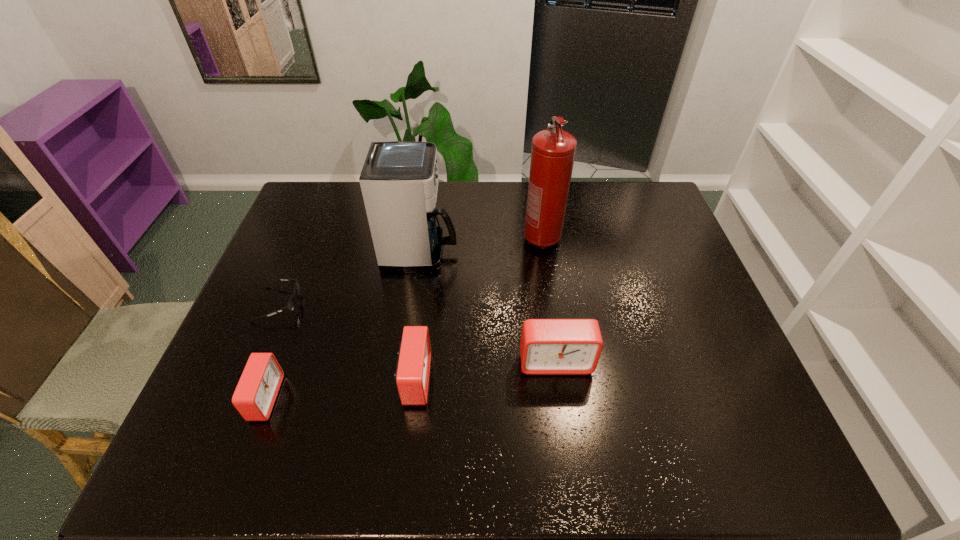
Observe the arrangement of all alarm clocks in the image. To keep them evenly spaced, where would you place another alarm clock on the right? Please locate a free space. Please provide its 2D coordinates. Your answer should be formatted as a tuple, i.e. [(x, y)], where the tuple contains the x and y coordinates of a point satisfying the conditions above.

[(687, 346)]